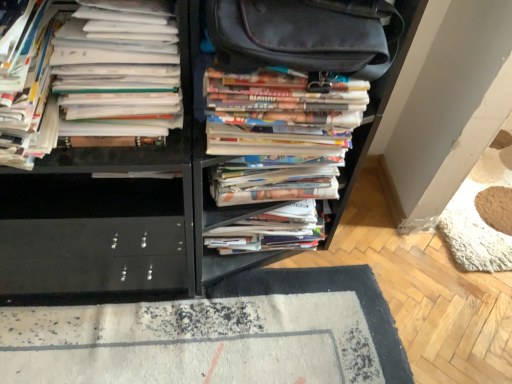
Question: Would you say white paper stack at left, which is the first book in left-to-right order, contains multicolored paper stack at center, placed as the 1th book when sorted from right to left?

Choices:
 (A) yes
 (B) no

Answer: (B)

Question: Is white paper stack at left, which is the 4th book from right to left, smaller than multicolored paper stack at center, acting as the fourth book starting from the left?

Choices:
 (A) yes
 (B) no

Answer: (B)

Question: From a real-world perspective, is white paper stack at left, which is the first book in left-to-right order, physically below multicolored paper stack at center, acting as the fourth book starting from the left?

Choices:
 (A) no
 (B) yes

Answer: (A)

Question: Is white paper stack at left, which is the first book in left-to-right order, to the left of multicolored paper stack at center, acting as the fourth book starting from the left, from the viewer's perspective?

Choices:
 (A) yes
 (B) no

Answer: (A)

Question: Is white paper stack at left, which is the 4th book from right to left, completely or partially outside of multicolored paper stack at center, placed as the 1th book when sorted from right to left?

Choices:
 (A) no
 (B) yes

Answer: (B)

Question: Considering the relative sizes of white paper stack at left, which is the 4th book from right to left, and multicolored paper stack at center, acting as the fourth book starting from the left, in the image provided, is white paper stack at left, which is the 4th book from right to left, thinner than multicolored paper stack at center, acting as the fourth book starting from the left,?

Choices:
 (A) no
 (B) yes

Answer: (A)

Question: Is multicolored paper stack at center, placed as the 1th book when sorted from right to left, facing towards white paper stack at left, which is the third book in right-to-left order?

Choices:
 (A) no
 (B) yes

Answer: (A)

Question: Can you confirm if multicolored paper stack at center, placed as the 1th book when sorted from right to left, is taller than white paper stack at left, which is the third book in right-to-left order?

Choices:
 (A) yes
 (B) no

Answer: (B)

Question: Can you confirm if multicolored paper stack at center, acting as the fourth book starting from the left, is bigger than white paper stack at left, arranged as the second book when viewed from the left?

Choices:
 (A) no
 (B) yes

Answer: (A)

Question: Is multicolored paper stack at center, placed as the 1th book when sorted from right to left, to the left of white paper stack at left, arranged as the second book when viewed from the left, from the viewer's perspective?

Choices:
 (A) yes
 (B) no

Answer: (B)

Question: Is multicolored paper stack at center, placed as the 1th book when sorted from right to left, outside of white paper stack at left, arranged as the second book when viewed from the left?

Choices:
 (A) yes
 (B) no

Answer: (A)

Question: Does multicolored paper stack at center, placed as the 1th book when sorted from right to left, come behind white paper stack at left, which is the third book in right-to-left order?

Choices:
 (A) no
 (B) yes

Answer: (B)

Question: Is white paper stack at left, which is the third book in right-to-left order, positioned in front of white paper stack at center, the 2th book from the right?

Choices:
 (A) no
 (B) yes

Answer: (B)